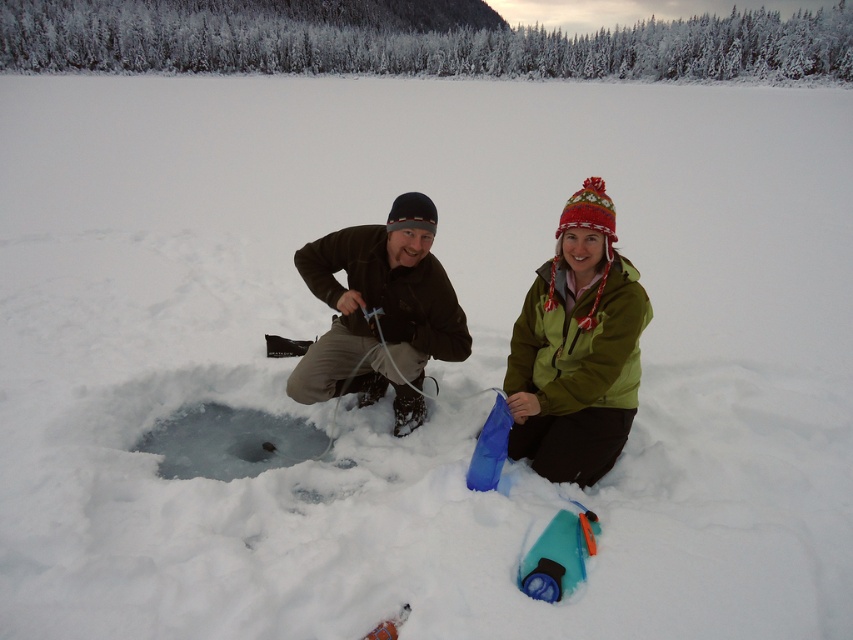
Question: Is green fuzzy jacket at lower right closer to the viewer compared to transparent ice hole at center?

Choices:
 (A) yes
 (B) no

Answer: (A)

Question: Estimate the real-world distances between objects in this image. Which object is closer to the green fuzzy jacket at lower right?

Choices:
 (A) dark brown fabric jacket at center
 (B) dark brown jacket at center
 (C) transparent ice hole at center

Answer: (B)

Question: From the image, what is the correct spatial relationship of dark brown jacket at center in relation to transparent ice hole at center?

Choices:
 (A) below
 (B) above

Answer: (B)

Question: Does dark brown jacket at center have a smaller size compared to green fuzzy jacket at lower right?

Choices:
 (A) no
 (B) yes

Answer: (B)

Question: Which of the following is the farthest from the observer?

Choices:
 (A) (416, 333)
 (B) (544, 301)
 (C) (550, 282)
 (D) (242, 429)

Answer: (D)

Question: Among these points, which one is nearest to the camera?

Choices:
 (A) (604, 269)
 (B) (410, 381)
 (C) (271, 460)
 (D) (592, 304)

Answer: (A)